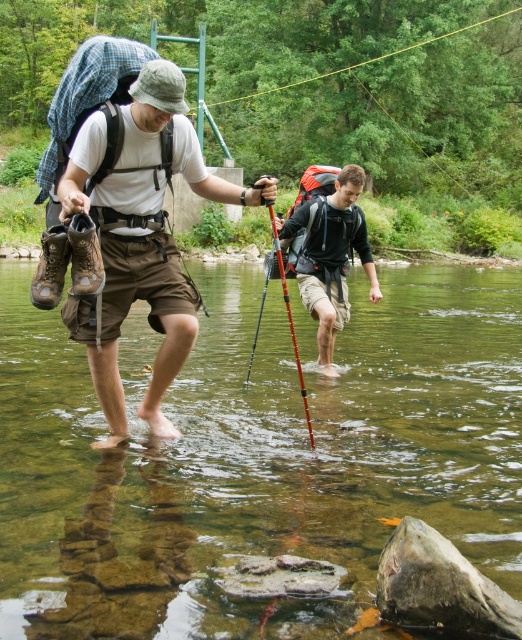
In the scene shown: Does matte brown shorts at center have a lesser width compared to red plastic pole at center?

Incorrect, matte brown shorts at center's width is not less than red plastic pole at center's.

Is matte brown shorts at center below red plastic pole at center?

Yes, matte brown shorts at center is below red plastic pole at center.

Who is more forward, (148, 166) or (304, 403)?

Point (148, 166) is more forward.

Locate an element on the screen. The width and height of the screenshot is (522, 640). matte brown shorts at center is located at coordinates (141, 237).

Can you confirm if clear water at center is bigger than red plastic pole at center?

Indeed, clear water at center has a larger size compared to red plastic pole at center.

What do you see at coordinates (255, 456) in the screenshot? The width and height of the screenshot is (522, 640). I see `clear water at center` at bounding box center [255, 456].

At what (x,y) coordinates should I click in order to perform the action: click on clear water at center. Please return your answer as a coordinate pair (x, y). The width and height of the screenshot is (522, 640). Looking at the image, I should click on point(255,456).

Who is shorter, clear water at center or matte brown shorts at center?

clear water at center is shorter.

Who is positioned more to the right, clear water at center or matte brown shorts at center?

From the viewer's perspective, clear water at center appears more on the right side.

Does point (441, 468) come in front of point (183, 305)?

No.

Locate an element on the screen. The height and width of the screenshot is (640, 522). clear water at center is located at coordinates (255, 456).